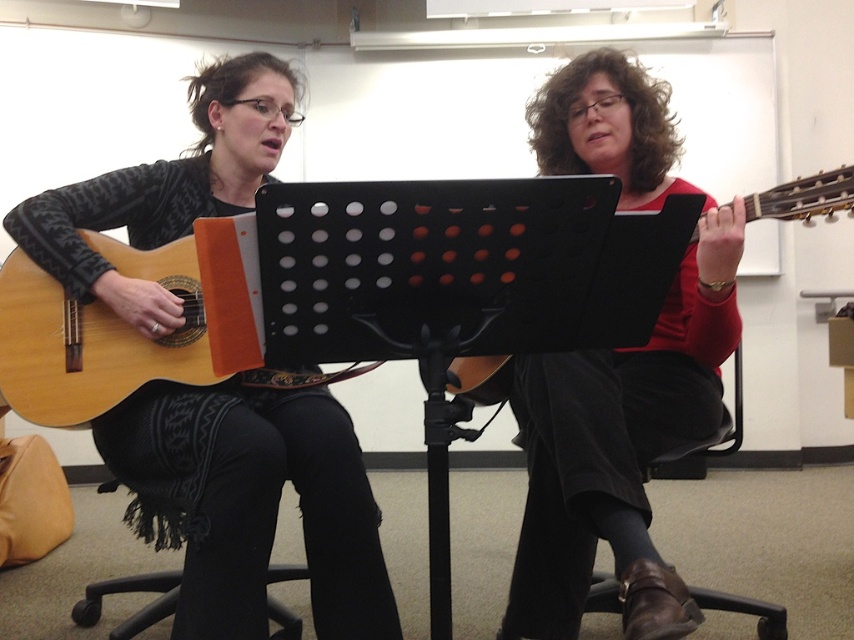
Is matte red sweater at center smaller than light brown acoustic guitar at left?

Actually, matte red sweater at center might be larger than light brown acoustic guitar at left.

Is point (524, 435) behind point (34, 272)?

Yes, it is.

Which is behind, point (686, 378) or point (237, 365)?

The point (686, 378) is behind.

Identify the location of matte red sweater at center. The width and height of the screenshot is (854, 640). (619, 449).

Who is higher up, matte red sweater at center or black leather chair at lower center?

matte red sweater at center is above.

Who is more forward, [578,141] or [700,456]?

Point [700,456]

Does point (670, 132) come farther from viewer compared to point (648, 468)?

Yes, point (670, 132) is farther from viewer.

You are a GUI agent. You are given a task and a screenshot of the screen. Output one action in this format:
    pyautogui.click(x=<x>, y=<y>)
    Task: Click on the matte red sweater at center
    Image resolution: width=854 pixels, height=640 pixels.
    Given the screenshot: What is the action you would take?
    pyautogui.click(x=619, y=449)

Who is shorter, matte brown guitar at right or black leather chair at lower center?

With less height is black leather chair at lower center.

Locate an element on the screen. Image resolution: width=854 pixels, height=640 pixels. matte brown guitar at right is located at coordinates (804, 196).

What are the coordinates of `matte brown guitar at right` in the screenshot? It's located at (804, 196).

Image resolution: width=854 pixels, height=640 pixels. Identify the location of matte brown guitar at right. (x=804, y=196).